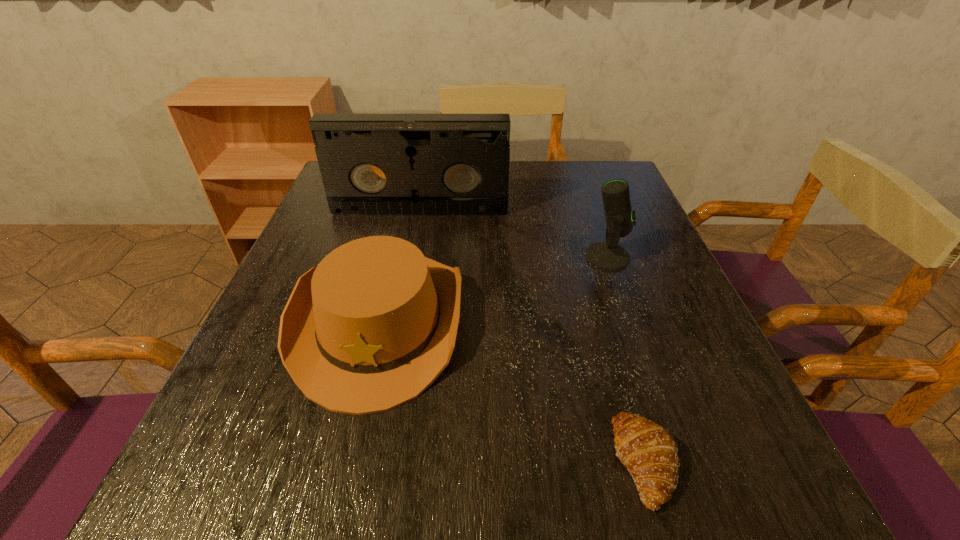
Where is `object located at the near edge`? object located at the near edge is located at coordinates (649, 452).

The height and width of the screenshot is (540, 960). What are the coordinates of `videotape present at the left edge` in the screenshot? It's located at (371, 164).

Locate an element on the screen. This screenshot has height=540, width=960. cowboy hat that is at the left edge is located at coordinates (371, 327).

This screenshot has height=540, width=960. In order to click on microphone located at the right edge in this screenshot , I will do `click(608, 255)`.

This screenshot has width=960, height=540. I want to click on crescent roll located in the right edge section of the desktop, so click(649, 452).

Find the location of `object present at the near right corner`. object present at the near right corner is located at coordinates (649, 452).

Where is `blank space at the far edge of the desktop`? Image resolution: width=960 pixels, height=540 pixels. blank space at the far edge of the desktop is located at coordinates (550, 161).

Identify the location of free space at the near edge of the desktop. Image resolution: width=960 pixels, height=540 pixels. point(383,524).

I want to click on blank area at the left edge, so click(263, 379).

Find the location of a particular element. Image resolution: width=960 pixels, height=540 pixels. free space at the right edge of the desktop is located at coordinates pyautogui.click(x=659, y=296).